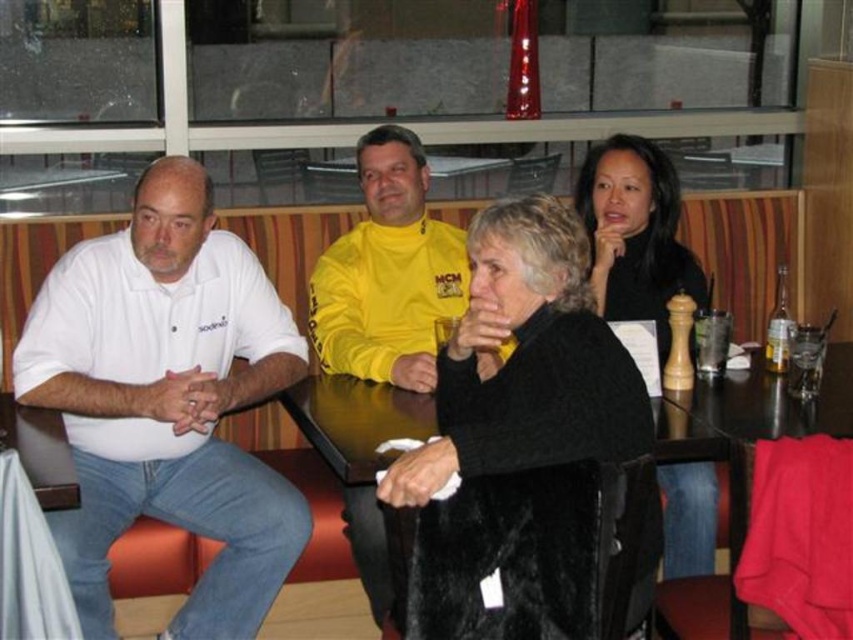
Between black fuzzy coat at center and black matte jacket at upper right, which one is positioned higher?

black matte jacket at upper right

Who is more forward, (x=468, y=468) or (x=618, y=179)?

Point (x=468, y=468) is in front.

Between point (445, 582) and point (624, 236), which one is positioned behind?

Point (624, 236)

This screenshot has height=640, width=853. I want to click on black fuzzy coat at center, so click(x=519, y=438).

In the scene shown: Is white cotton shirt at left further to camera compared to black fuzzy coat at center?

Yes, white cotton shirt at left is further from the viewer.

Measure the distance between white cotton shirt at left and camera.

white cotton shirt at left and camera are 6.85 feet apart.

Where is `white cotton shirt at left`? The height and width of the screenshot is (640, 853). white cotton shirt at left is located at coordinates (167, 401).

Does black fuzzy coat at center have a greater height compared to yellow fleece jacket at center?

Indeed, black fuzzy coat at center has a greater height compared to yellow fleece jacket at center.

Does black fuzzy coat at center come in front of yellow fleece jacket at center?

Yes, it is in front of yellow fleece jacket at center.

Locate an element on the screen. This screenshot has width=853, height=640. black fuzzy coat at center is located at coordinates (519, 438).

The width and height of the screenshot is (853, 640). In order to click on black fuzzy coat at center in this screenshot , I will do `click(519, 438)`.